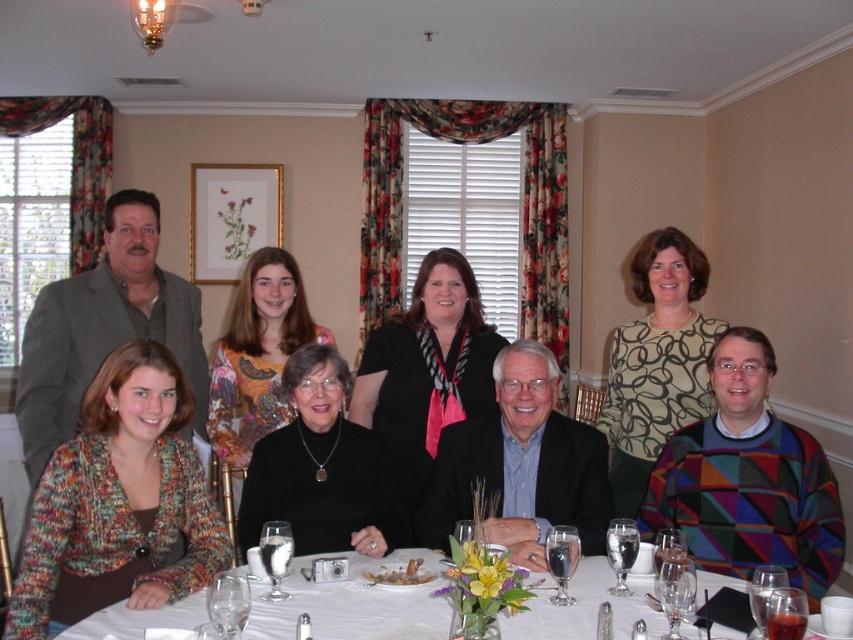
Does multicolored sweater at lower left have a greater height compared to white porcelain table at center?

Yes.

Between multicolored sweater at lower left and white porcelain table at center, which one has less height?

With less height is white porcelain table at center.

Does point (39, 332) come closer to viewer compared to point (425, 564)?

No, it is not.

At what (x,y) coordinates should I click in order to perform the action: click on multicolored sweater at lower left. Please return your answer as a coordinate pair (x, y). Looking at the image, I should click on (657, 352).

Who is positioned more to the right, white porcelain table at center or printed fabric blouse at center?

printed fabric blouse at center

Between white porcelain table at center and printed fabric blouse at center, which one is positioned higher?

printed fabric blouse at center

Describe the element at coordinates (349, 604) in the screenshot. The height and width of the screenshot is (640, 853). I see `white porcelain table at center` at that location.

The image size is (853, 640). What are the coordinates of `white porcelain table at center` in the screenshot? It's located at click(x=349, y=604).

Where is `multicolored sweater at lower left`? This screenshot has height=640, width=853. multicolored sweater at lower left is located at coordinates (657, 352).

Between multicolored sweater at lower left and black sweater at center, which one is positioned lower?

black sweater at center is below.

At what (x,y) coordinates should I click in order to perform the action: click on multicolored sweater at lower left. Please return your answer as a coordinate pair (x, y). Looking at the image, I should click on (657, 352).

You are a GUI agent. You are given a task and a screenshot of the screen. Output one action in this format:
    pyautogui.click(x=<x>, y=<y>)
    Task: Click on the multicolored sweater at lower left
    This screenshot has width=853, height=640.
    Given the screenshot: What is the action you would take?
    pyautogui.click(x=657, y=352)